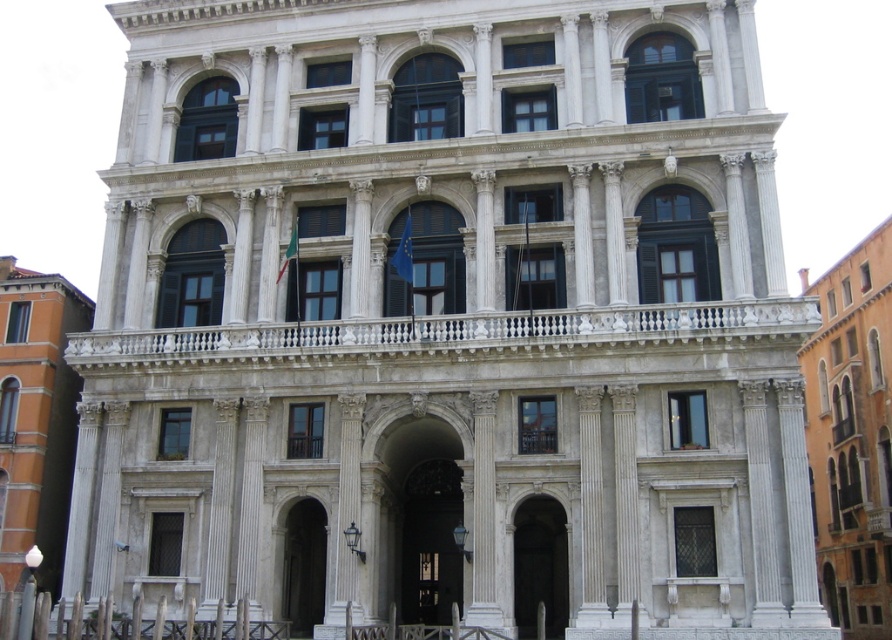
You are standing at the center of the image. Which direction should you walk to reach the orange stucco building at right?

Since the orange stucco building at right is located at point 0.681 on the x axis and 0.955 on the y axis, you should walk towards the right and slightly upwards to reach it.